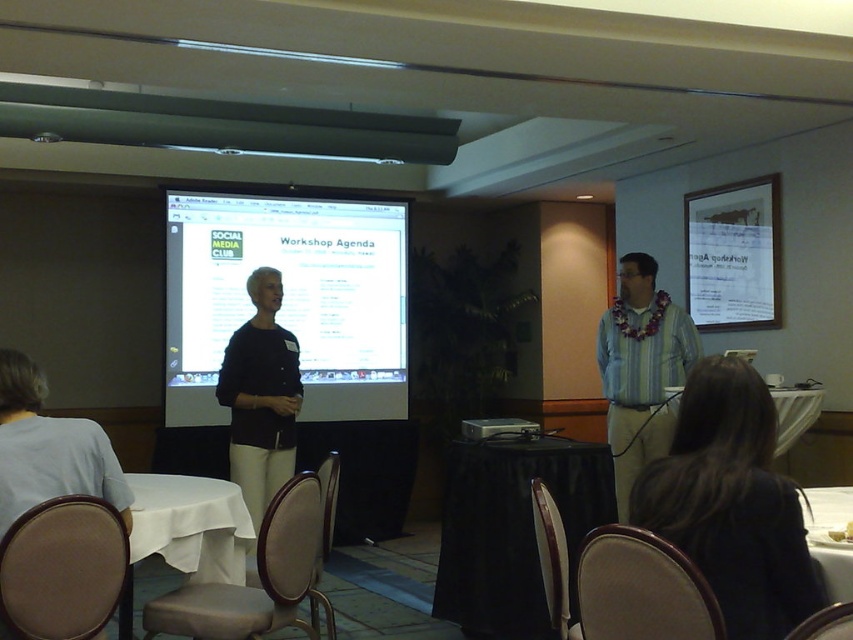
Question: Does black fabric table at center appear over white tablecloth at lower right?

Choices:
 (A) yes
 (B) no

Answer: (B)

Question: Which point is farther from the camera taking this photo?

Choices:
 (A) (842, 570)
 (B) (514, 560)
 (C) (815, 413)

Answer: (C)

Question: Can you confirm if white glossy projector screen at center is wider than black matte sweater at center?

Choices:
 (A) no
 (B) yes

Answer: (B)

Question: Which object appears closest to the camera in this image?

Choices:
 (A) white glossy table at lower right
 (B) white tablecloth at lower right
 (C) black fabric table at center

Answer: (A)

Question: Which of the following is the closest to the observer?

Choices:
 (A) tap(813, 595)
 (B) tap(321, 268)

Answer: (A)

Question: Is white glossy table at lower right thinner than white tablecloth at lower right?

Choices:
 (A) yes
 (B) no

Answer: (B)